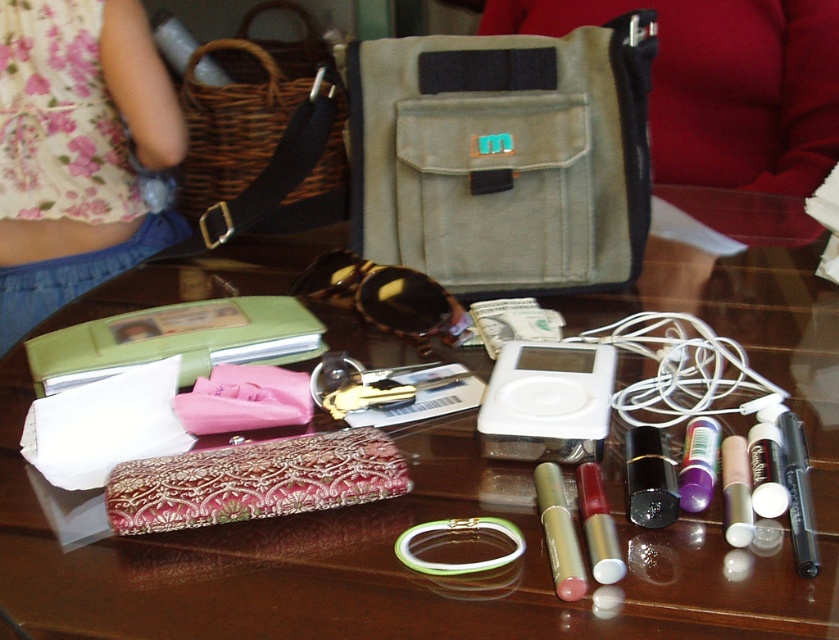
Question: Estimate the real-world distances between objects in this image. Which object is farther from the olive green canvas pouch at center?

Choices:
 (A) embroidered fabric pouch at center
 (B) purple glossy lipstick at center

Answer: (A)

Question: Does shiny brown table at center have a smaller size compared to metallic silver lipstick at center?

Choices:
 (A) yes
 (B) no

Answer: (B)

Question: Does floral fabric dress at upper left appear on the left side of embroidered fabric pouch at center?

Choices:
 (A) no
 (B) yes

Answer: (B)

Question: Which point appears closest to the camera in this image?

Choices:
 (A) (30, 240)
 (B) (701, 483)
 (C) (134, 634)

Answer: (C)

Question: Where is olive green canvas pouch at center located in relation to embroidered fabric pouch at center in the image?

Choices:
 (A) above
 (B) below

Answer: (A)

Question: Estimate the real-world distances between objects in this image. Which object is farther from the olive green canvas pouch at center?

Choices:
 (A) shiny brown table at center
 (B) metallic silver lipstick at center
 (C) purple glossy lipstick at center

Answer: (B)